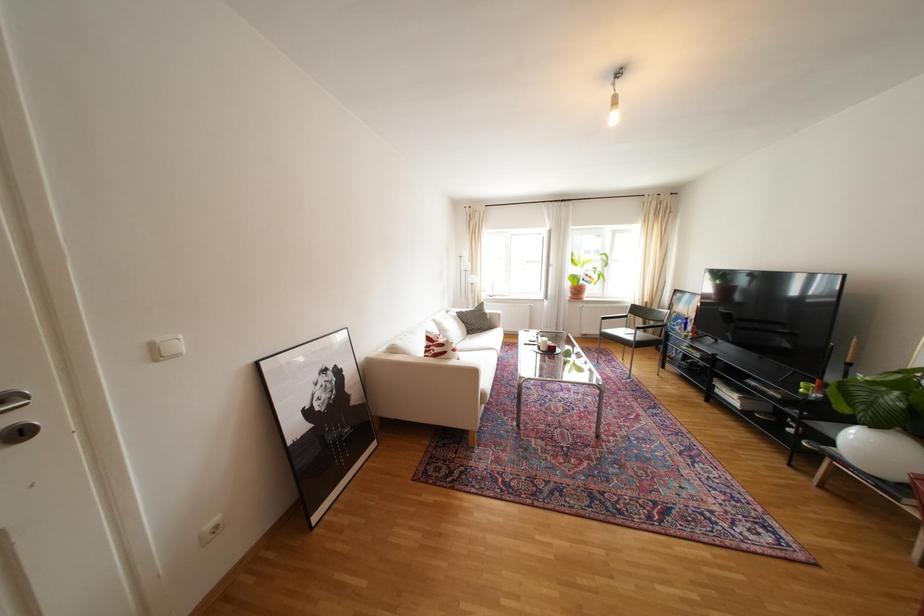
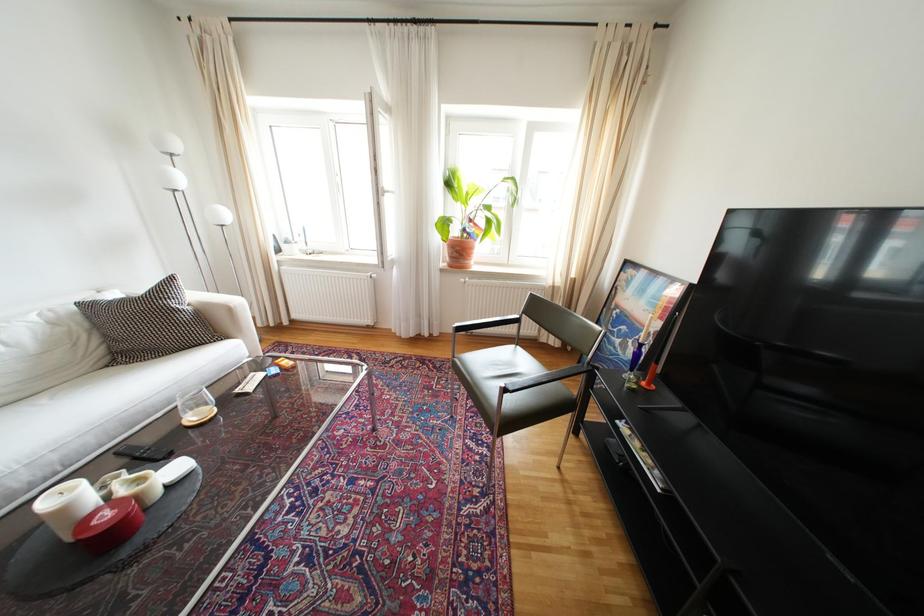
The images are taken continuously from a first-person perspective. In which direction are you moving?

The cameraman walked toward right, forward.